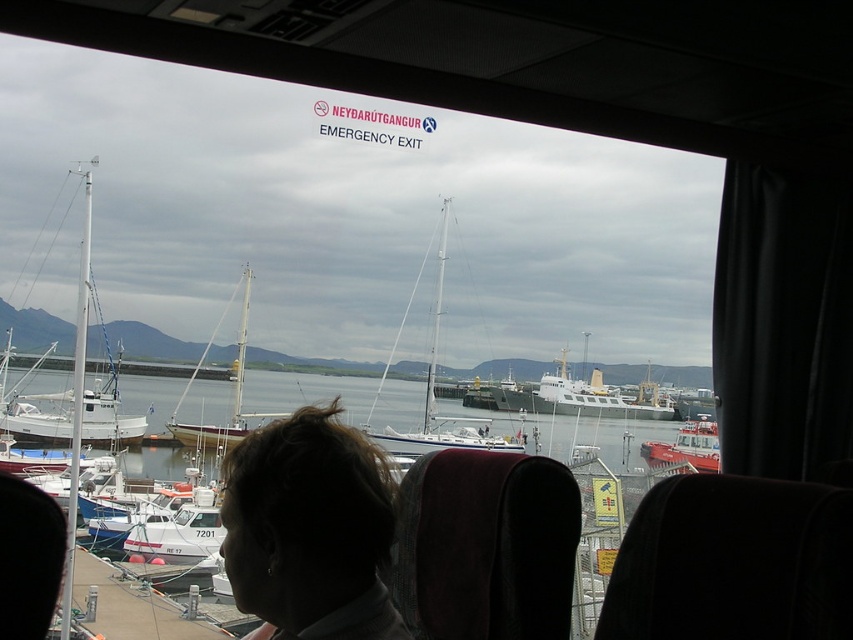
Question: Among these objects, which one is farthest from the camera?

Choices:
 (A) clear water at center
 (B) white wooden sailboat at center

Answer: (A)

Question: Does clear water at center appear on the right side of white matte sailboat at center?

Choices:
 (A) no
 (B) yes

Answer: (B)

Question: Among these points, which one is nearest to the camera?

Choices:
 (A) (595, 410)
 (B) (712, 467)

Answer: (B)

Question: Which point is closer to the camera?

Choices:
 (A) dark brown hair at center
 (B) clear water at center
 (C) white matte sailboat at left

Answer: (A)

Question: Can you confirm if white matte sailboat at left is positioned to the right of white glossy ship at center?

Choices:
 (A) yes
 (B) no

Answer: (B)

Question: Is white wooden sailboat at center above red rubber dinghy at lower right?

Choices:
 (A) no
 (B) yes

Answer: (B)